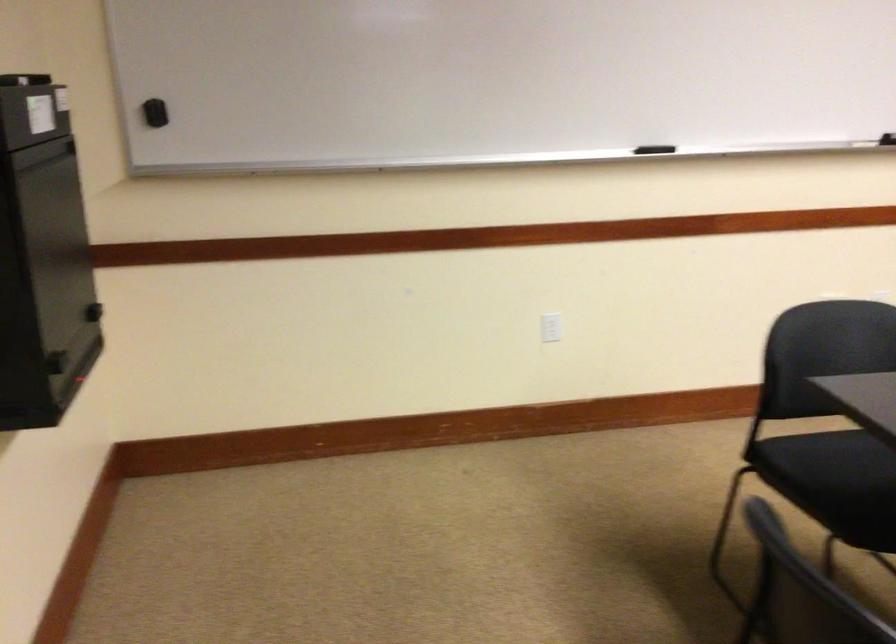
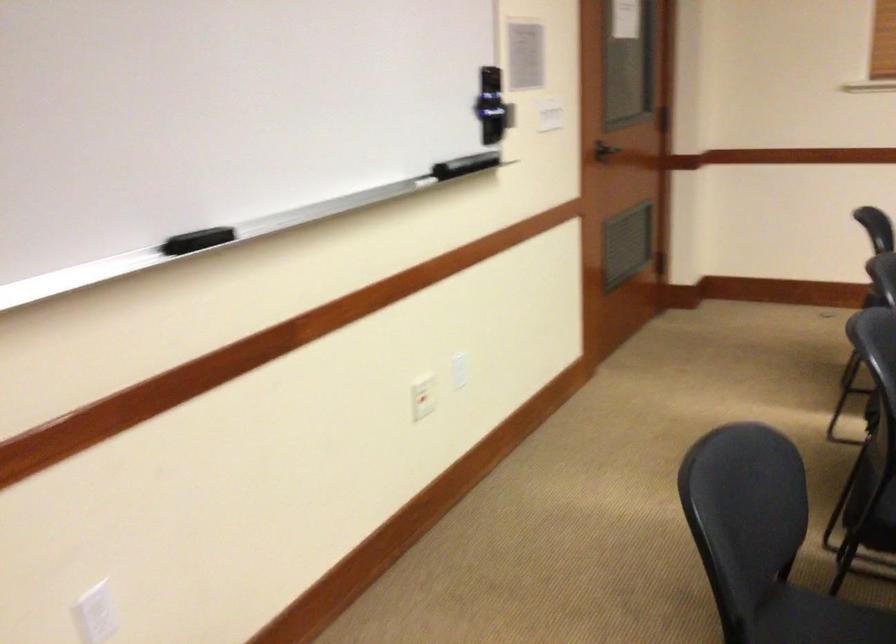
How did the camera likely rotate?

The rotation direction of the camera is right-down.